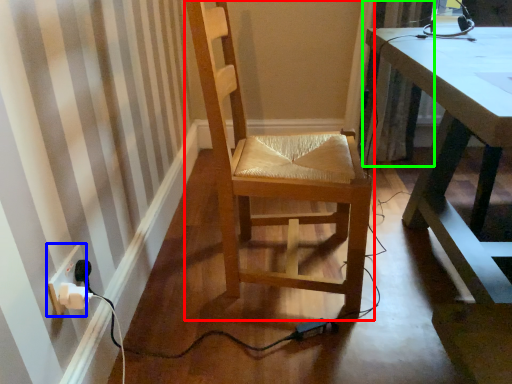
Question: Considering the real-world distances, which object is closest to chair (highlighted by a red box)? electric outlet (highlighted by a blue box) or curtain (highlighted by a green box).

Choices:
 (A) electric outlet
 (B) curtain

Answer: (A)